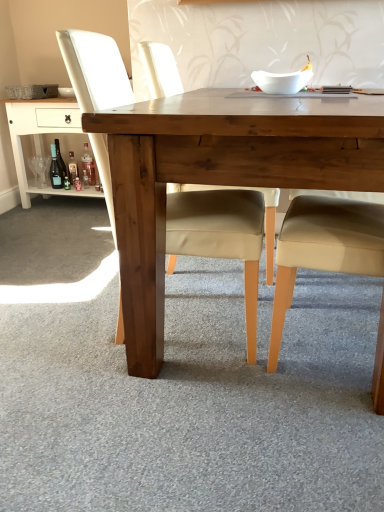
Find the location of a particular element. wooden table at center is located at coordinates (219, 175).

At what (x,y) coordinates should I click in order to perform the action: click on translucent plastic bottle at lower left, the first bottle viewed from the right. Please return your answer as a coordinate pair (x, y). Looking at the image, I should click on (88, 166).

I want to click on translucent glass bottle at lower left, which is the second bottle in right-to-left order, so click(x=72, y=168).

Which of these two, translucent glass bottle at lower left, which is the second bottle in right-to-left order, or wooden table at center, stands shorter?

translucent glass bottle at lower left, which is the second bottle in right-to-left order, is shorter.

Which of these two, translucent glass bottle at lower left, which is the second bottle in right-to-left order, or wooden table at center, is bigger?

wooden table at center is bigger.

Consider the image. Is translucent glass bottle at lower left, which appears as the 2th bottle when viewed from the left, at the left side of wooden table at center?

Yes, translucent glass bottle at lower left, which appears as the 2th bottle when viewed from the left, is to the left of wooden table at center.

Is wooden table at center wider than translucent plastic bottle at lower left, arranged as the third bottle when viewed from the left?

Yes, wooden table at center is wider than translucent plastic bottle at lower left, arranged as the third bottle when viewed from the left.

Is wooden table at center far from translucent plastic bottle at lower left, arranged as the third bottle when viewed from the left?

Yes, wooden table at center and translucent plastic bottle at lower left, arranged as the third bottle when viewed from the left, are located far from each other.

From the image's perspective, is wooden table at center positioned above or below translucent plastic bottle at lower left, the first bottle viewed from the right?

wooden table at center is below translucent plastic bottle at lower left, the first bottle viewed from the right.

Considering the positions of objects wooden table at center and translucent plastic bottle at lower left, the first bottle viewed from the right, in the image provided, who is more to the right, wooden table at center or translucent plastic bottle at lower left, the first bottle viewed from the right,?

Positioned to the right is wooden table at center.

From a real-world perspective, which is physically below, matte beige chair at center or wooden table at lower left?

In real-world perspective, wooden table at lower left is lower.

Locate an element on the screen. The image size is (384, 512). table above the matte beige chair at center (from the image's perspective) is located at coordinates (42, 135).

Considering the sizes of objects matte beige chair at center and wooden table at lower left in the image provided, who is bigger, matte beige chair at center or wooden table at lower left?

matte beige chair at center.

Considering the relative sizes of matte beige chair at center and wooden table at lower left in the image provided, is matte beige chair at center wider than wooden table at lower left?

Yes.

Based on their sizes in the image, would you say wooden table at center is bigger or smaller than translucent glass bottle at lower left, which is the second bottle in right-to-left order?

wooden table at center is bigger than translucent glass bottle at lower left, which is the second bottle in right-to-left order.

From the image's perspective, is wooden table at center under translucent glass bottle at lower left, which is the second bottle in right-to-left order?

Yes, from the image's perspective, wooden table at center is below translucent glass bottle at lower left, which is the second bottle in right-to-left order.

Is wooden table at center next to translucent glass bottle at lower left, which is the second bottle in right-to-left order?

No.

Which object is further away from the camera, matte beige chair at center or translucent plastic bottle at lower left, the first bottle viewed from the right?

translucent plastic bottle at lower left, the first bottle viewed from the right, is further away from the camera.

Which is behind, point (250, 278) or point (94, 163)?

The point (94, 163) is farther.

Is matte beige chair at center oriented towards translucent plastic bottle at lower left, the first bottle viewed from the right?

No, matte beige chair at center is not oriented towards translucent plastic bottle at lower left, the first bottle viewed from the right.

How much distance is there between matte beige chair at center and translucent plastic bottle at lower left, arranged as the third bottle when viewed from the left?

matte beige chair at center is 2.00 meters from translucent plastic bottle at lower left, arranged as the third bottle when viewed from the left.

Could translucent plastic bottle at lower left, the first bottle viewed from the right, be considered to be inside white glossy bowl at upper center?

Actually, translucent plastic bottle at lower left, the first bottle viewed from the right, is outside white glossy bowl at upper center.

Which is more distant, (259,79) or (92,183)?

The point (92,183) is farther from the camera.

Which object is closer to the camera taking this photo, translucent plastic bottle at lower left, arranged as the third bottle when viewed from the left, or translucent glass bottle at lower left, which is the second bottle in right-to-left order?

translucent plastic bottle at lower left, arranged as the third bottle when viewed from the left, is closer to the camera.

From a real-world perspective, is translucent plastic bottle at lower left, the first bottle viewed from the right, positioned under translucent glass bottle at lower left, which is the second bottle in right-to-left order, based on gravity?

No, from a real-world perspective, translucent plastic bottle at lower left, the first bottle viewed from the right, is not beneath translucent glass bottle at lower left, which is the second bottle in right-to-left order.

Is translucent plastic bottle at lower left, the first bottle viewed from the right, situated inside translucent glass bottle at lower left, which is the second bottle in right-to-left order, or outside?

translucent plastic bottle at lower left, the first bottle viewed from the right, exists outside the volume of translucent glass bottle at lower left, which is the second bottle in right-to-left order.

Is translucent plastic bottle at lower left, arranged as the third bottle when viewed from the left, facing away from translucent glass bottle at lower left, which is the second bottle in right-to-left order?

translucent plastic bottle at lower left, arranged as the third bottle when viewed from the left, does not have its back to translucent glass bottle at lower left, which is the second bottle in right-to-left order.

Locate an element on the screen. Image resolution: width=384 pixels, height=512 pixels. the 2nd bottle counting from the left of the wooden table at center is located at coordinates (72, 168).

Where is `bottle that is the 2nd one when counting backward from the wooden table at center`? The width and height of the screenshot is (384, 512). bottle that is the 2nd one when counting backward from the wooden table at center is located at coordinates coord(88,166).

Considering their positions, is translucent glass bottle at lower left, which appears as the 2th bottle when viewed from the left, positioned closer to translucent plastic bottle at lower left, arranged as the third bottle when viewed from the left, than matte beige chair at center?

translucent glass bottle at lower left, which appears as the 2th bottle when viewed from the left.

When comparing their distances from matte glass bottle at lower left, which is counted as the third bottle, starting from the right, does white glossy bowl at upper center or wooden table at center seem closer?

Among the two, white glossy bowl at upper center is located nearer to matte glass bottle at lower left, which is counted as the third bottle, starting from the right.

Looking at the image, which one is located closer to white glossy bowl at upper center, matte glass bottle at lower left, the 1th bottle viewed from the left, or wooden table at lower left?

wooden table at lower left.

When comparing their distances from wooden table at center, does white glossy bowl at upper center or matte beige chair at center seem further?

white glossy bowl at upper center is positioned further to the anchor wooden table at center.

Consider the image. When comparing their distances from translucent plastic bottle at lower left, the first bottle viewed from the right, does white glossy bowl at upper center or wooden table at lower left seem closer?

wooden table at lower left is positioned closer to the anchor translucent plastic bottle at lower left, the first bottle viewed from the right.

Estimate the real-world distances between objects in this image. Which object is closer to matte glass bottle at lower left, which is counted as the third bottle, starting from the right, wooden table at lower left or white glossy bowl at upper center?

wooden table at lower left is positioned closer to the anchor matte glass bottle at lower left, which is counted as the third bottle, starting from the right.

In the scene shown: Looking at the image, which one is located further to wooden table at lower left, matte glass bottle at lower left, the 1th bottle viewed from the left, or white glossy bowl at upper center?

white glossy bowl at upper center is positioned further to the anchor wooden table at lower left.

Which object lies further to the anchor point translucent plastic bottle at lower left, arranged as the third bottle when viewed from the left, matte beige chair at center or wooden table at lower left?

matte beige chair at center.

The height and width of the screenshot is (512, 384). Identify the location of chair between wooden table at center and translucent glass bottle at lower left, which appears as the 2th bottle when viewed from the left, along the z-axis. (221, 234).

The height and width of the screenshot is (512, 384). In order to click on bottle between white glossy bowl at upper center and translucent plastic bottle at lower left, arranged as the third bottle when viewed from the left, from front to back in this screenshot , I will do `click(55, 169)`.

Identify the location of bowl positioned between matte beige chair at center and matte glass bottle at lower left, the 1th bottle viewed from the left, from near to far. (281, 81).

At what (x,y) coordinates should I click in order to perform the action: click on bowl between matte beige chair at center and translucent glass bottle at lower left, which appears as the 2th bottle when viewed from the left, in the front-back direction. Please return your answer as a coordinate pair (x, y). The image size is (384, 512). Looking at the image, I should click on (281, 81).